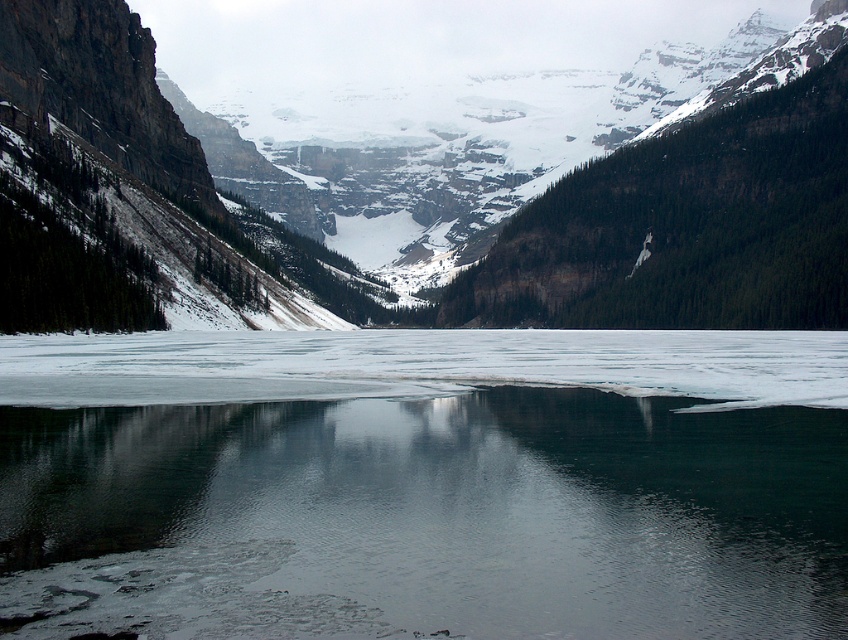
Measure the distance between point (679, 602) and camera.

The distance of point (679, 602) from camera is 209.24 meters.

Is clear ice at center smaller than snowy rock mountain at center?

Yes.

Who is more forward, (257, 410) or (151, 86)?

Positioned in front is point (257, 410).

The width and height of the screenshot is (848, 640). What are the coordinates of `clear ice at center` in the screenshot? It's located at (424, 483).